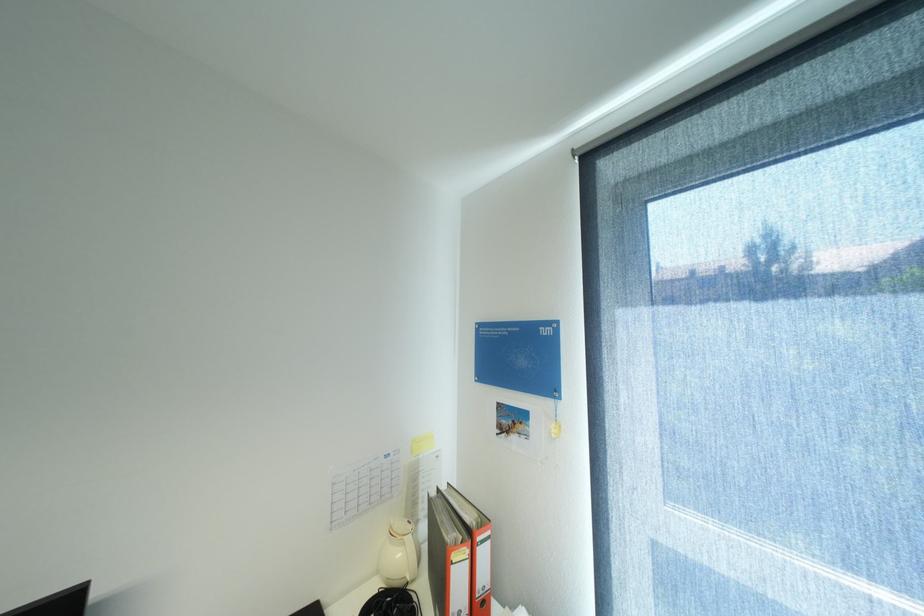
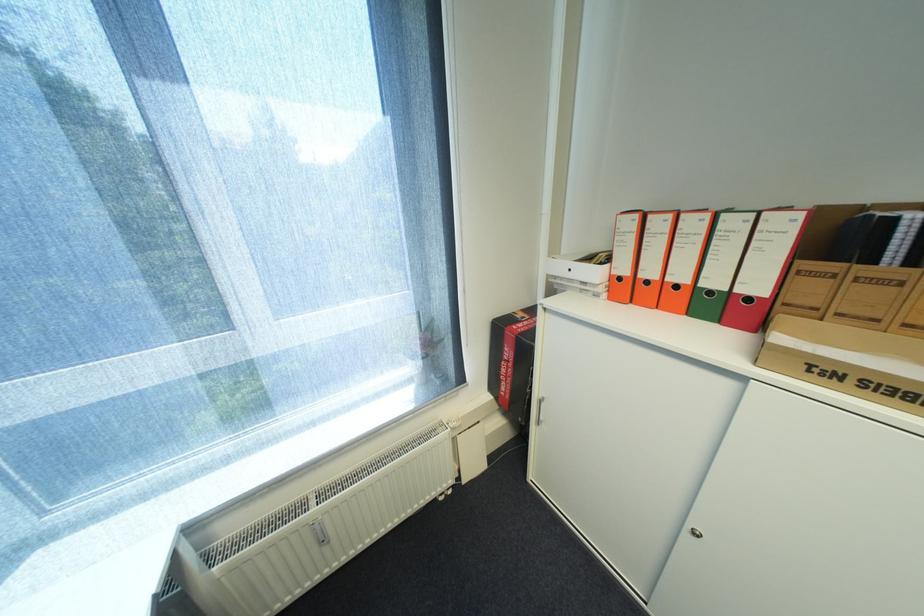
How did the camera likely rotate?

The camera rotated toward right-down.